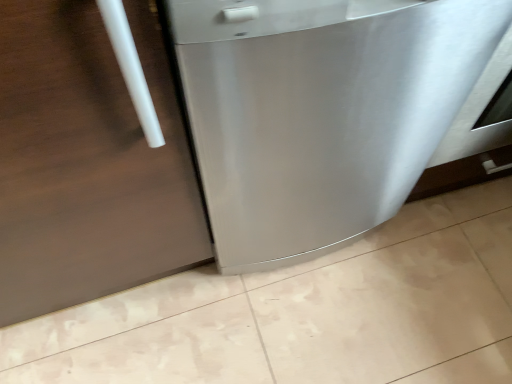
Question: From the image's perspective, is stainless steel door at left located above or below stainless steel dishwasher at center?

Choices:
 (A) above
 (B) below

Answer: (B)

Question: In terms of height, does stainless steel door at left look taller or shorter compared to stainless steel dishwasher at center?

Choices:
 (A) short
 (B) tall

Answer: (B)

Question: Considering the positions of stainless steel door at left and stainless steel dishwasher at center in the image, is stainless steel door at left wider or thinner than stainless steel dishwasher at center?

Choices:
 (A) wide
 (B) thin

Answer: (B)

Question: Considering the relative positions of stainless steel dishwasher at center and stainless steel door at left in the image provided, is stainless steel dishwasher at center to the left or to the right of stainless steel door at left?

Choices:
 (A) right
 (B) left

Answer: (A)

Question: Considering their positions, is stainless steel dishwasher at center located in front of or behind stainless steel door at left?

Choices:
 (A) behind
 (B) front

Answer: (A)

Question: From the image's perspective, is stainless steel dishwasher at center located above or below stainless steel door at left?

Choices:
 (A) above
 (B) below

Answer: (A)

Question: From a real-world perspective, is stainless steel dishwasher at center positioned above or below stainless steel door at left?

Choices:
 (A) above
 (B) below

Answer: (B)